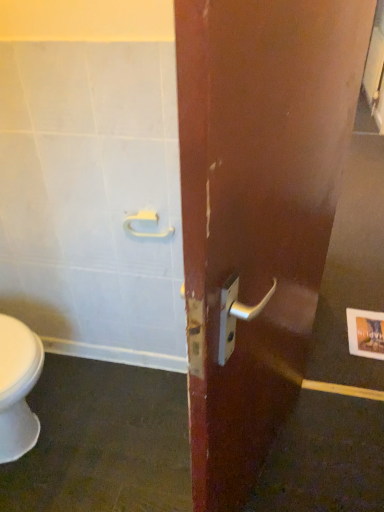
The image size is (384, 512). Identify the location of vacant area to the left of matte brown door at center. (124, 443).